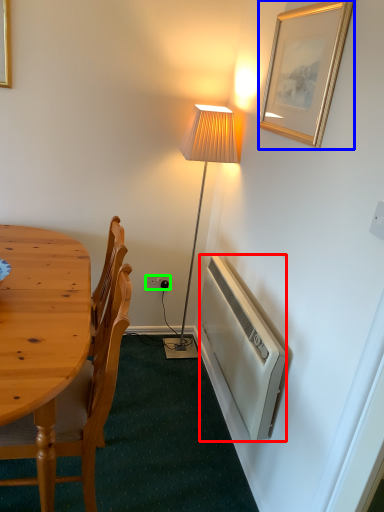
Question: Considering the real-world distances, which object is closest to radiator (highlighted by a red box)? picture frame (highlighted by a blue box) or power outlet (highlighted by a green box).

Choices:
 (A) picture frame
 (B) power outlet

Answer: (A)